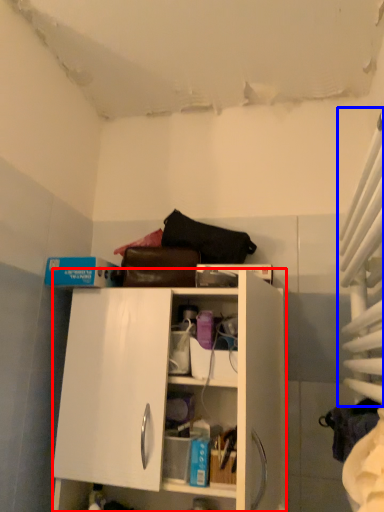
Question: Among these objects, which one is farthest to the camera, cabinetry (highlighted by a red box) or curtain (highlighted by a blue box)?

Choices:
 (A) cabinetry
 (B) curtain

Answer: (A)